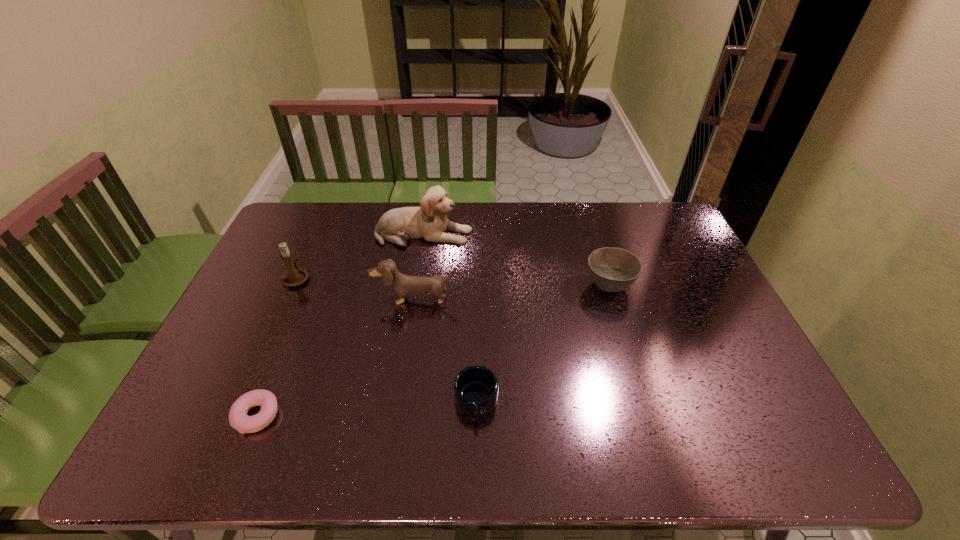
Locate an element on the screen. This screenshot has height=540, width=960. free space between the tallest object and the nearer puppy is located at coordinates (420, 266).

Locate an element on the screen. This screenshot has height=540, width=960. free spot between the bowl and the candle holder is located at coordinates (453, 281).

I want to click on vacant space that is in between the nearer puppy and the doughnut, so click(x=336, y=357).

Find the location of `free space between the doughnut and the shorter puppy`. free space between the doughnut and the shorter puppy is located at coordinates (336, 357).

Image resolution: width=960 pixels, height=540 pixels. I want to click on vacant area that lies between the shortest object and the taller puppy, so [x=341, y=325].

Locate an element on the screen. The width and height of the screenshot is (960, 540). free space between the shortest object and the candle holder is located at coordinates (276, 347).

At what (x,y) coordinates should I click in order to perform the action: click on the second closest object relative to the second shortest object. Please return your answer as a coordinate pair (x, y). This screenshot has height=540, width=960. Looking at the image, I should click on (612, 269).

Locate which object is the third closest to the candle holder. Please provide its 2D coordinates. Your answer should be formatted as a tuple, i.e. [(x, y)], where the tuple contains the x and y coordinates of a point satisfying the conditions above.

[(238, 418)]

The width and height of the screenshot is (960, 540). I want to click on free space that satisfies the following two spatial constraints: 1. on the front-facing side of the farthest object; 2. on the front side of the doughnut, so click(396, 416).

Find the location of a particular element. vacant space that satisfies the following two spatial constraints: 1. on the front-facing side of the tallest object; 2. on the left side of the bowl is located at coordinates (416, 285).